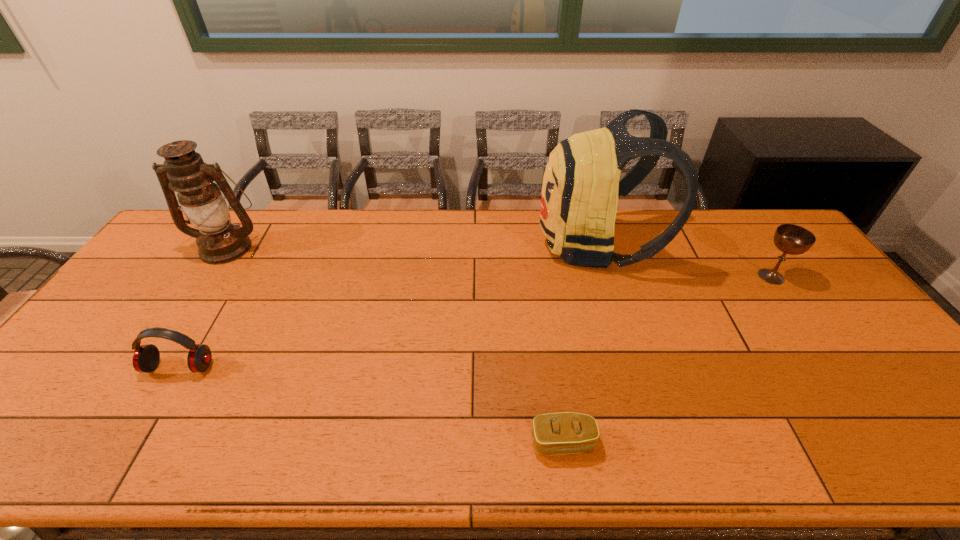
Where is `vacant point at the far edge`? vacant point at the far edge is located at coordinates (321, 215).

Identify the location of vacant space at the near edge. (397, 446).

You are a GUI agent. You are given a task and a screenshot of the screen. Output one action in this format:
    pyautogui.click(x=<x>, y=<y>)
    Task: Click on the vacant area at the right edge of the desktop
    
    Given the screenshot: What is the action you would take?
    pyautogui.click(x=854, y=368)

This screenshot has height=540, width=960. Find the location of `free location at the far left corner of the desktop`. free location at the far left corner of the desktop is located at coordinates click(175, 234).

In the image, there is a desktop. Where is `vacant space at the near right corner`? The image size is (960, 540). vacant space at the near right corner is located at coordinates (914, 430).

Locate an element on the screen. This screenshot has width=960, height=540. vacant area between the lantern and the third shortest object is located at coordinates (499, 262).

You are a GUI agent. You are given a task and a screenshot of the screen. Output one action in this format:
    pyautogui.click(x=<x>, y=<y>)
    Task: Click on the free point between the nearest object and the lantern
    
    Given the screenshot: What is the action you would take?
    pyautogui.click(x=396, y=345)

The width and height of the screenshot is (960, 540). What are the coordinates of `free point between the second shortest object and the lantern` in the screenshot? It's located at (204, 307).

Locate an element on the screen. The image size is (960, 540). blank region between the fourth tallest object and the lantern is located at coordinates (204, 307).

Where is `free space between the lantern and the backpack`? free space between the lantern and the backpack is located at coordinates (411, 246).